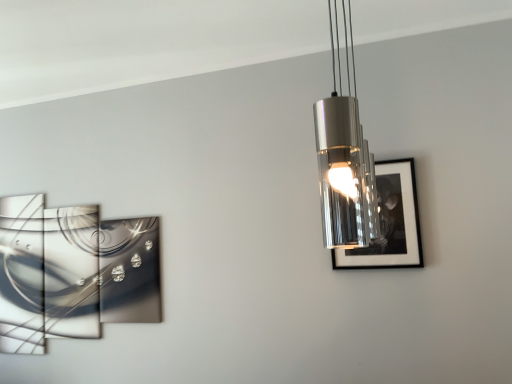
Question: Is metallic cylindrical light fixture at upper center at the back of black glossy picture frame at right, marked as the second picture frame in a left-to-right arrangement?

Choices:
 (A) yes
 (B) no

Answer: (B)

Question: Can you see black glossy picture frame at right, acting as the 1th picture frame starting from the front, touching metallic cylindrical light fixture at upper center?

Choices:
 (A) yes
 (B) no

Answer: (B)

Question: Is black glossy picture frame at right, positioned as the second picture frame in back-to-front order, bigger than metallic cylindrical light fixture at upper center?

Choices:
 (A) yes
 (B) no

Answer: (B)

Question: Is black glossy picture frame at right, acting as the 1th picture frame starting from the front, thinner than metallic cylindrical light fixture at upper center?

Choices:
 (A) no
 (B) yes

Answer: (B)

Question: Is black glossy picture frame at right, positioned as the second picture frame in back-to-front order, behind metallic cylindrical light fixture at upper center?

Choices:
 (A) no
 (B) yes

Answer: (B)

Question: In terms of height, does metallic reflective artwork at left, the second picture frame when ordered from front to back, look taller or shorter compared to black glossy picture frame at right, marked as the second picture frame in a left-to-right arrangement?

Choices:
 (A) tall
 (B) short

Answer: (A)

Question: Is point (129, 294) closer or farther from the camera than point (351, 259)?

Choices:
 (A) farther
 (B) closer

Answer: (A)

Question: From a real-world perspective, is metallic reflective artwork at left, the second picture frame positioned from the right, above or below black glossy picture frame at right, positioned as the first picture frame in right-to-left order?

Choices:
 (A) above
 (B) below

Answer: (B)

Question: Considering the positions of metallic reflective artwork at left, which is the first picture frame from left to right, and black glossy picture frame at right, marked as the second picture frame in a left-to-right arrangement, in the image, is metallic reflective artwork at left, which is the first picture frame from left to right, bigger or smaller than black glossy picture frame at right, marked as the second picture frame in a left-to-right arrangement,?

Choices:
 (A) big
 (B) small

Answer: (A)

Question: Considering the positions of black glossy picture frame at right, acting as the 1th picture frame starting from the front, and metallic reflective artwork at left, the second picture frame when ordered from front to back, in the image, is black glossy picture frame at right, acting as the 1th picture frame starting from the front, bigger or smaller than metallic reflective artwork at left, the second picture frame when ordered from front to back,?

Choices:
 (A) big
 (B) small

Answer: (B)

Question: Is black glossy picture frame at right, acting as the 1th picture frame starting from the front, in front of or behind metallic reflective artwork at left, the second picture frame positioned from the right, in the image?

Choices:
 (A) behind
 (B) front

Answer: (B)

Question: Would you say black glossy picture frame at right, positioned as the second picture frame in back-to-front order, is to the left or to the right of metallic reflective artwork at left, which is the first picture frame from left to right, in the picture?

Choices:
 (A) left
 (B) right

Answer: (B)

Question: In terms of width, does black glossy picture frame at right, marked as the second picture frame in a left-to-right arrangement, look wider or thinner when compared to metallic reflective artwork at left, which is the first picture frame from left to right?

Choices:
 (A) thin
 (B) wide

Answer: (A)

Question: In terms of width, does metallic reflective artwork at left, the second picture frame when ordered from front to back, look wider or thinner when compared to metallic cylindrical light fixture at upper center?

Choices:
 (A) wide
 (B) thin

Answer: (B)

Question: Do you think metallic reflective artwork at left, the second picture frame when ordered from front to back, is within metallic cylindrical light fixture at upper center, or outside of it?

Choices:
 (A) outside
 (B) inside

Answer: (A)